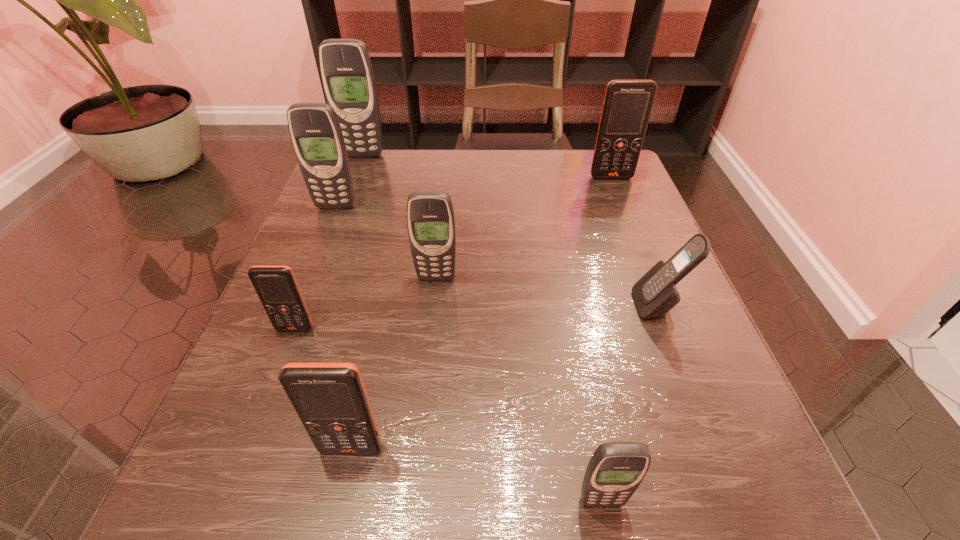
Identify the location of the farthest cellular telephone. (346, 70).

Where is `the biggest gray cellular telephone`? the biggest gray cellular telephone is located at coordinates (346, 70).

This screenshot has width=960, height=540. I want to click on the second farthest object, so click(627, 106).

Identify the location of the farthest orange cellular telephone. (627, 106).

This screenshot has width=960, height=540. In order to click on the sixth nearest object in this screenshot , I will do coord(316,135).

Locate an element on the screen. The height and width of the screenshot is (540, 960). the sixth nearest cellular telephone is located at coordinates (316, 135).

You are a GUI agent. You are given a task and a screenshot of the screen. Output one action in this format:
    pyautogui.click(x=<x>, y=<y>)
    Task: Click on the fourth object from right to left
    The width and height of the screenshot is (960, 540).
    Given the screenshot: What is the action you would take?
    pyautogui.click(x=430, y=216)

This screenshot has height=540, width=960. What are the coordinates of `the fifth nearest cellular telephone` in the screenshot? It's located at (430, 216).

What are the coordinates of `the seventh farthest object` in the screenshot? It's located at (330, 399).

The width and height of the screenshot is (960, 540). I want to click on the nearest orange cellular telephone, so click(x=330, y=399).